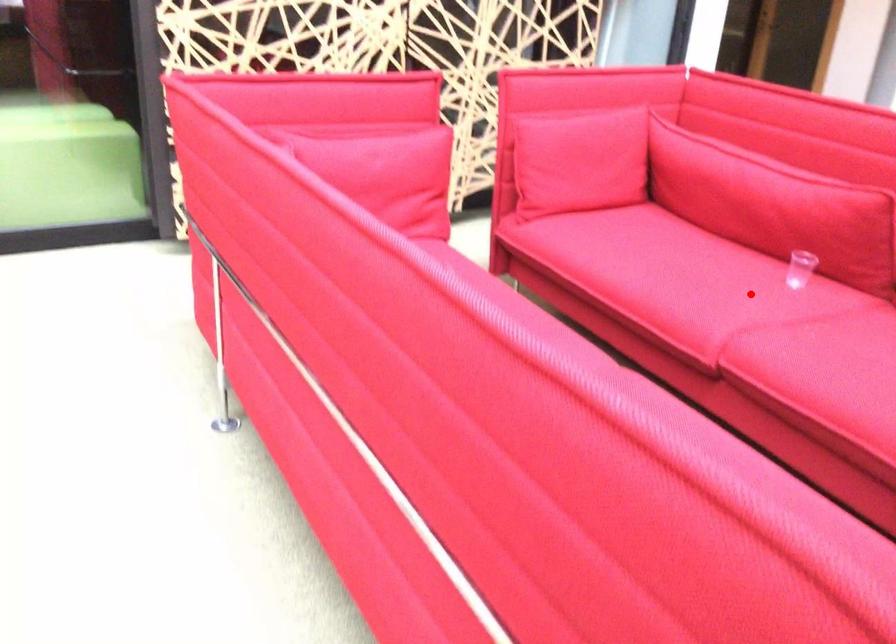
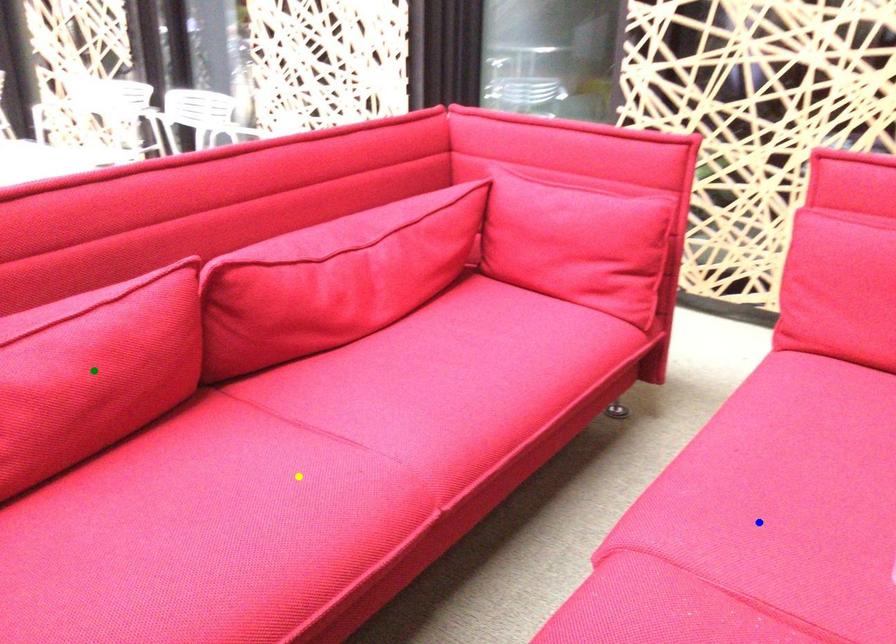
Question: I am providing you with two images of the same scene from different viewpoints. A red point is marked on the first image. You are given multiple points on the second image. Can you choose the point in image 2 that corresponds to the point in image 1?

Choices:
 (A) green point
 (B) blue point
 (C) yellow point

Answer: (B)